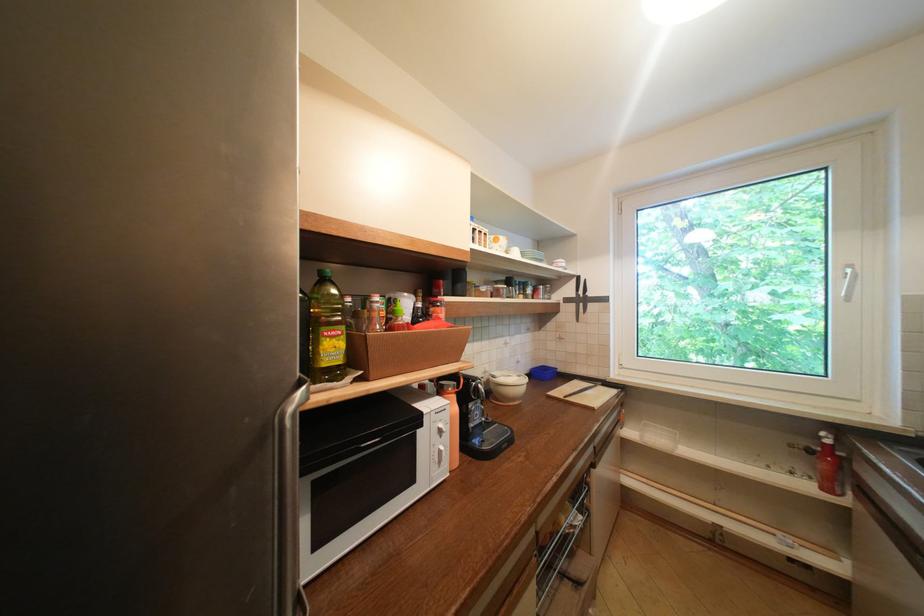
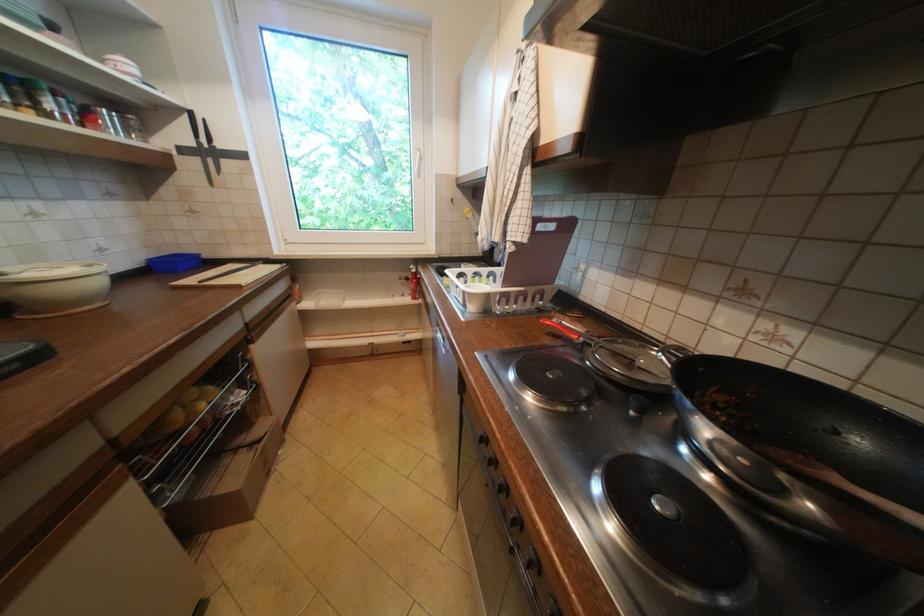
Locate, in the second image, the point that corresponds to the point at 799,474 in the first image.

(410, 296)